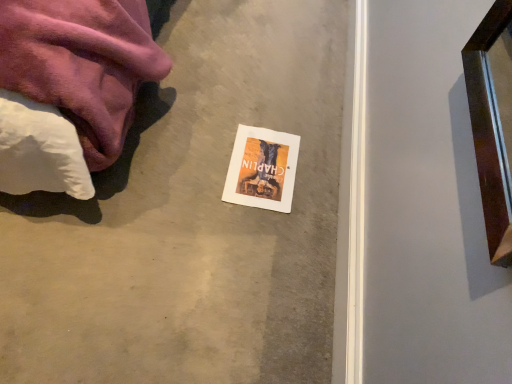
Find the location of a particular element. The width and height of the screenshot is (512, 384). free point above orange matte paper flyer at center (from a real-world perspective) is located at coordinates (261, 160).